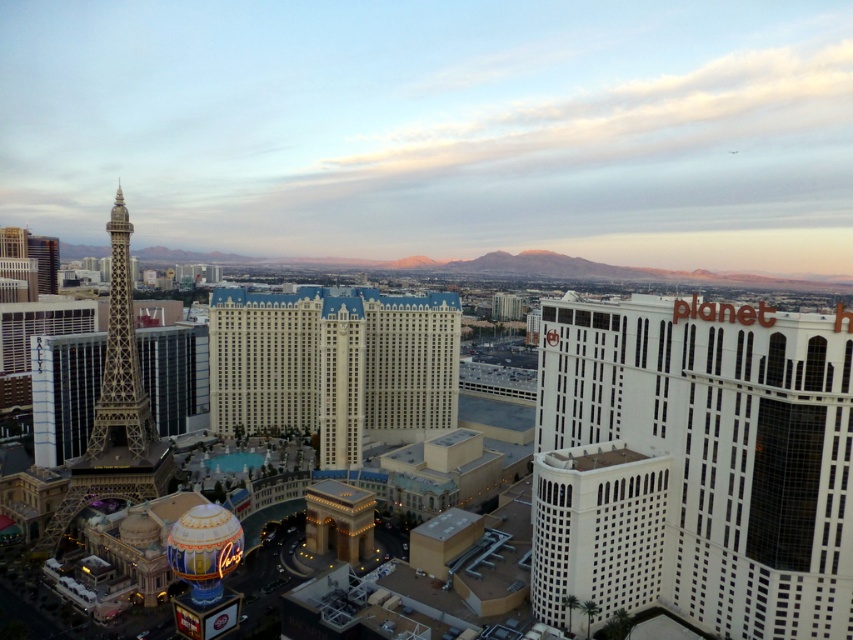
You are an architect evaluating the city skyline. Which of the two buildings, the white glass building at right or the white textured building at center, would you say is the taller one based on their positions in the image?

The white glass building at right is much taller than the white textured building at center, making it the taller of the two.

You are standing at the center of the city square and want to take a photo of the matte glass tower at left. According to the scene description, where should you position yourself to capture the tower in your shot?

The matte glass tower at left is located at point (438, 129), so you should position yourself facing the left side of the city square to capture the tower in your shot.